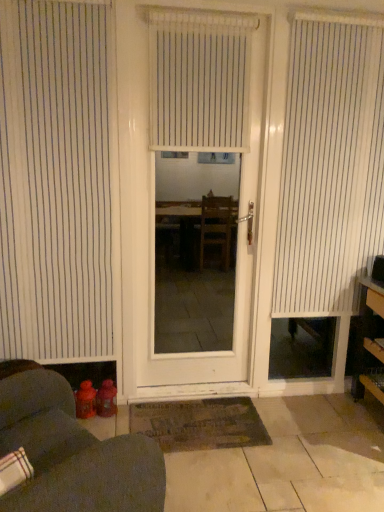
What are the coordinates of `vacant area that lies to the right of dark brown textured mat at center` in the screenshot? It's located at (303, 445).